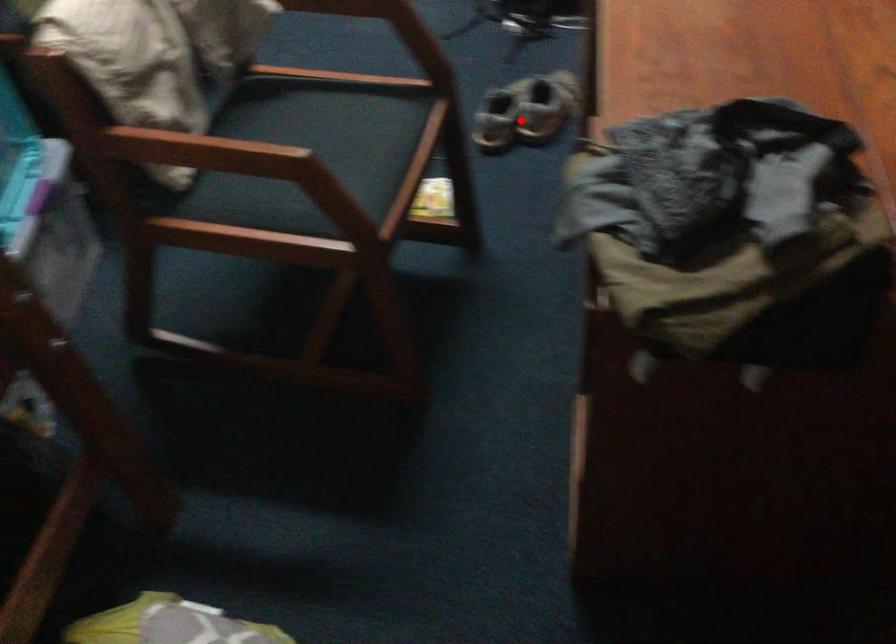
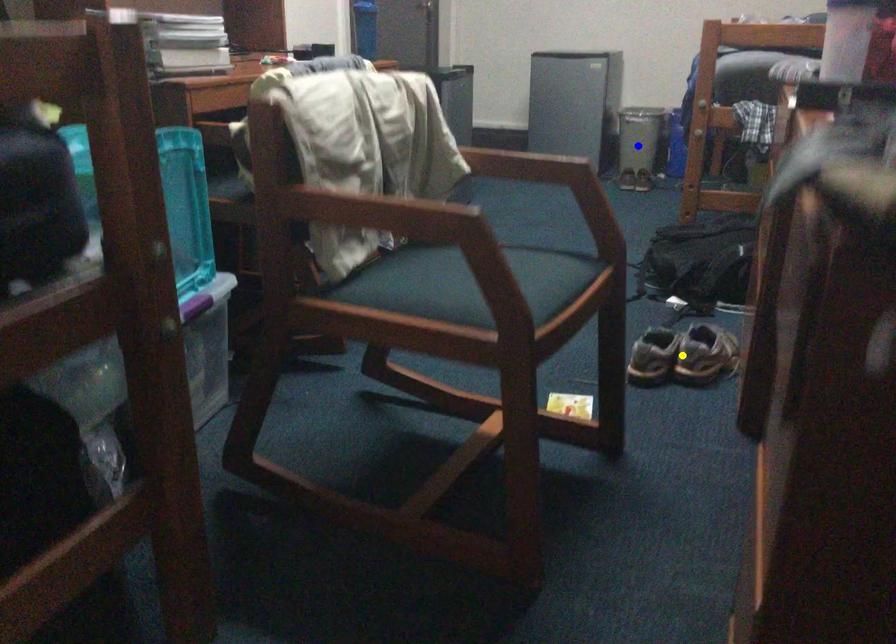
Question: I am providing you with two images of the same scene from different viewpoints. A red point is marked on the first image. You are given multiple points on the second image. Can you choose the point in image 2 that corresponds to the point in image 1?

Choices:
 (A) green point
 (B) blue point
 (C) yellow point

Answer: (C)